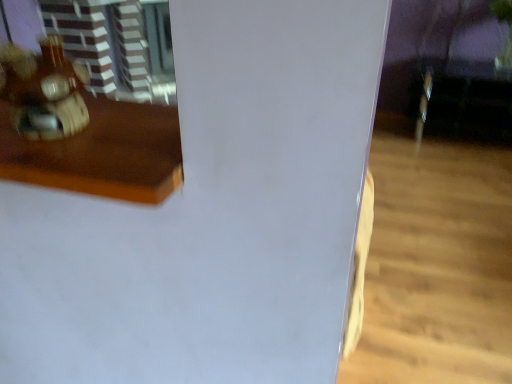
You are a GUI agent. You are given a task and a screenshot of the screen. Output one action in this format:
    pyautogui.click(x=<x>, y=<y>)
    Task: Click on the free location in front of wooden toy at left
    The width and height of the screenshot is (512, 384).
    Given the screenshot: What is the action you would take?
    pyautogui.click(x=49, y=163)